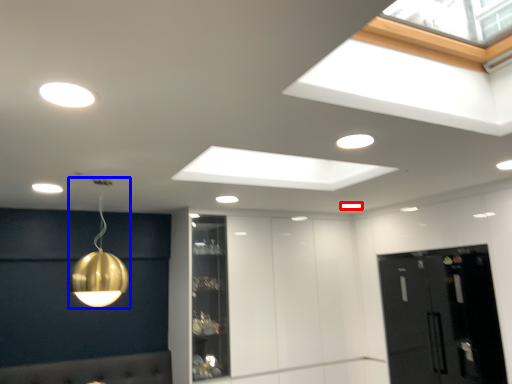
Question: Which point is closer to the camera, lamp (highlighted by a red box) or lamp (highlighted by a blue box)?

Choices:
 (A) lamp
 (B) lamp

Answer: (B)